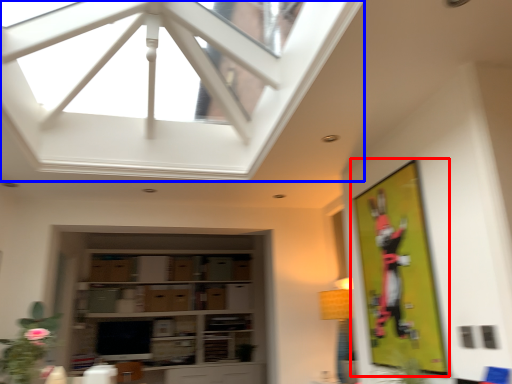
Question: Among these objects, which one is farthest to the camera, bulletin board (highlighted by a red box) or window (highlighted by a blue box)?

Choices:
 (A) bulletin board
 (B) window

Answer: (A)